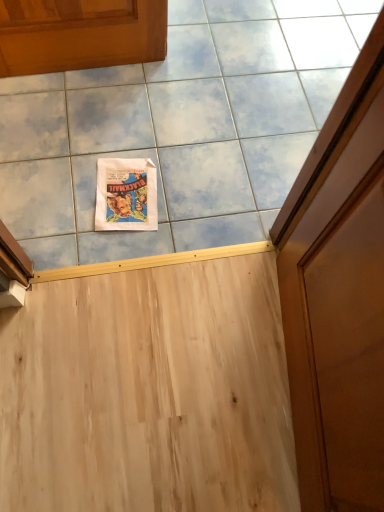
Locate an element on the screen. vacant area on top of matte paper comic book at upper center (from a real-world perspective) is located at coordinates (130, 189).